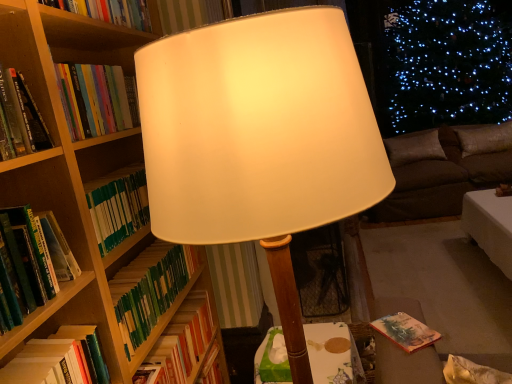
Question: Is point (47, 286) closer or farther from the camera than point (480, 140)?

Choices:
 (A) closer
 (B) farther

Answer: (A)

Question: Looking at their shapes, would you say green hardcover book at left, which is the 2th book from top to bottom, is wider or thinner than brown fabric pillow at right, marked as the 2th pillow in a left-to-right arrangement?

Choices:
 (A) thin
 (B) wide

Answer: (A)

Question: Which of these objects is positioned closest to the wooden table at center?

Choices:
 (A) brown suede pillow at right, placed as the first pillow when sorted from left to right
 (B) hardcover book at left, which appears as the 2th book when ordered from the bottom
 (C) green matte book at left, the fourth book when ordered from top to bottom
 (D) green hardcover book at left, which is the 3th book in bottom-to-top order
 (E) hardcover book at upper left, which is the first book in top-to-bottom order

Answer: (C)

Question: Based on their relative distances, which object is nearer to the matte white lampshade at center?

Choices:
 (A) green matte book at left, the fourth book when ordered from top to bottom
 (B) dark brown fabric couch at right
 (C) green hardcover book at left, which is the 2th book from top to bottom
 (D) hardcover book at upper left, the 4th book in the bottom-to-top sequence
 (E) brown suede pillow at right, arranged as the 2th pillow when viewed from the right

Answer: (C)